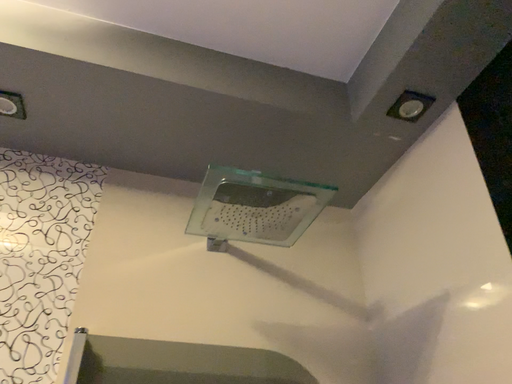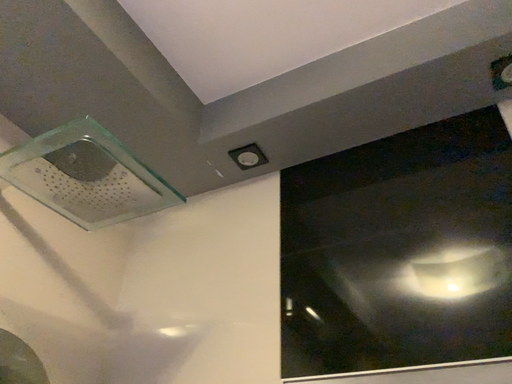
Question: How did the camera likely rotate when shooting the video?

Choices:
 (A) rotated downward
 (B) rotated upward

Answer: (A)